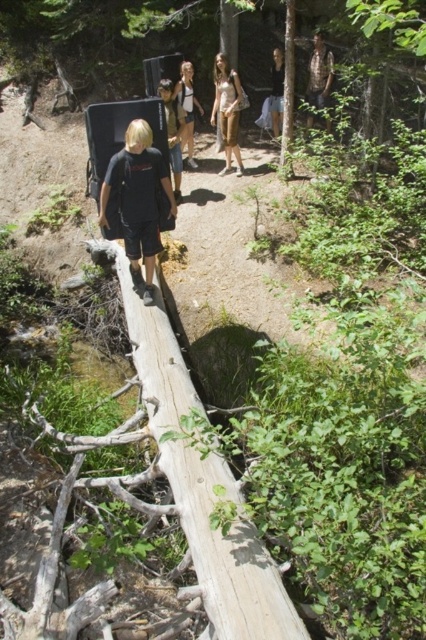
You are a hiker trying to cross the stream using the log bridge. You notice two people on the log bridge ahead of you. One is wearing a black cotton shirt at center and the other a matte white tank top at center. Which person is closer to you as you approach the log bridge?

The black cotton shirt at center is closer to you because it is in front of the matte white tank top at center on the log bridge.

Based on the photo, you are a hiker wearing both the light brown fabric dress at center and the matte white tank top at center. You need to cross the fallen log bridge over the stream. Considering the height difference between the two garments, which one would allow you to move more freely and safely across the log?

The matte white tank top at center allows for more freedom of movement since it is shorter in height compared to the light brown fabric dress at center, reducing the risk of tripping or getting caught on the log.

You are standing on the log bridge in the forest and want to move towards the stream below. Which point, point [215,90] or point [175,97], is closer to you as you step forward?

Point [215,90] is further to the viewer than point [175,97]. Therefore, point [175,97] is closer to you as you step forward.